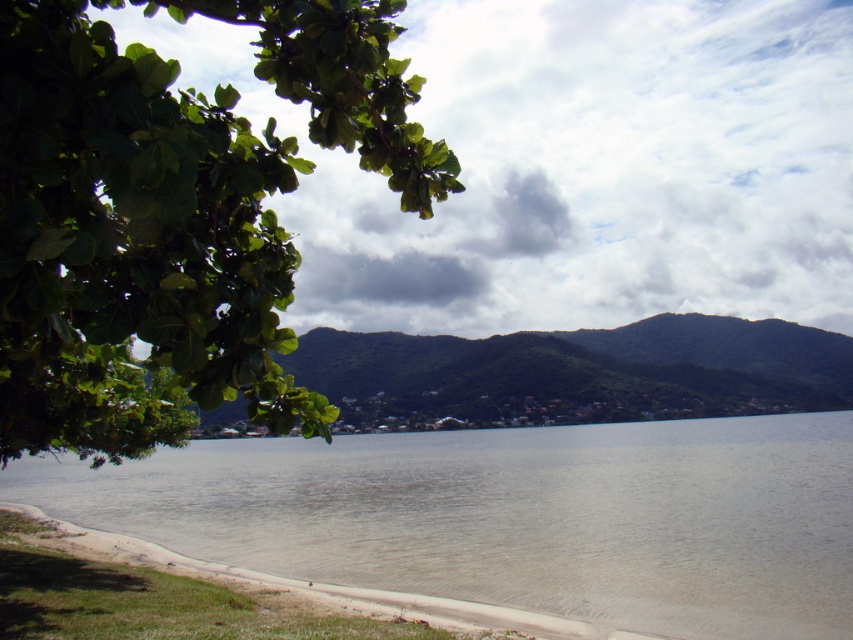
You are a painter setting up your easel on the beach. You want to capture the scene accurately. Which object, the green leafy branch at upper left or the clear water at lower center, would you need to paint in a smaller scale?

The green leafy branch at upper left has a smaller size compared to the clear water at lower center, so you should paint the green leafy branch at upper left in a smaller scale.

You are standing on the beach and want to take a photo of the clear water at lower center without the green leafy branch at upper left blocking the view. Which direction should you move to ensure the branch is out of frame?

Move to the right so that the green leafy branch at upper left is no longer in the frame blocking the clear water at lower center.